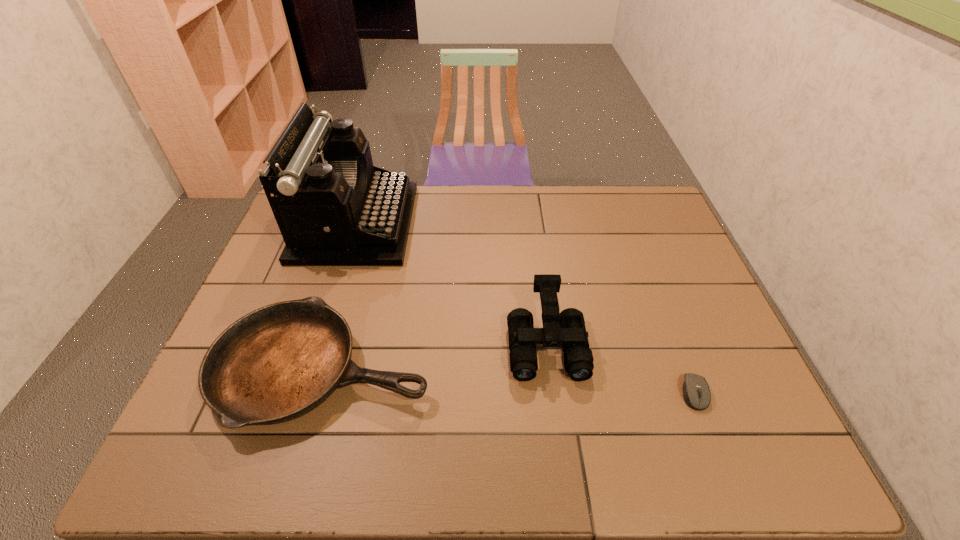
Identify the location of the farthest object. (333, 207).

Find the location of a particular element. This screenshot has height=540, width=960. typewriter is located at coordinates (333, 207).

Locate an element on the screen. This screenshot has width=960, height=540. the second tallest object is located at coordinates (567, 329).

Where is `the third object from left to right`? the third object from left to right is located at coordinates (567, 329).

The width and height of the screenshot is (960, 540). In order to click on frying pan in this screenshot , I will do `click(277, 363)`.

Where is `computer equipment`? This screenshot has width=960, height=540. computer equipment is located at coordinates (696, 392).

I want to click on the rightmost object, so click(x=696, y=392).

The width and height of the screenshot is (960, 540). Identify the location of vacant space situated on the typing side of the tallest object. (497, 223).

Locate an element on the screen. free region located on the front lenses of the third object from left to right is located at coordinates (559, 440).

Locate an element on the screen. This screenshot has width=960, height=540. vacant area situated 0.150m on the right of the frying pan is located at coordinates (493, 369).